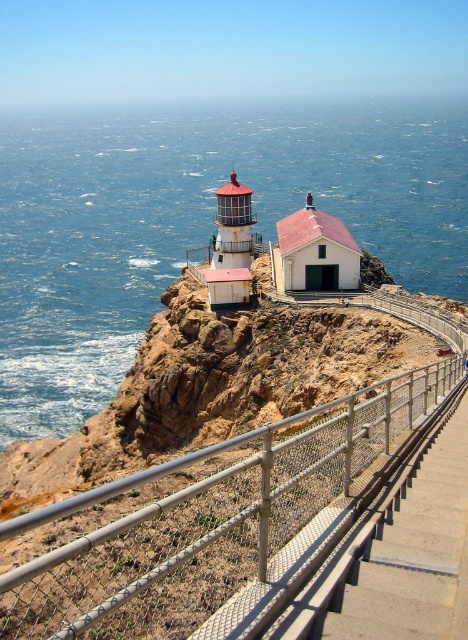
Is point (174, 148) positioned after point (248, 436)?

Yes, point (174, 148) is behind point (248, 436).

Who is taller, blue water at upper left or metal mesh railing at center?

With more height is blue water at upper left.

Between point (440, 179) and point (366, 451), which one is positioned behind?

The point (440, 179) is behind.

Identify the location of blue water at upper left. (196, 220).